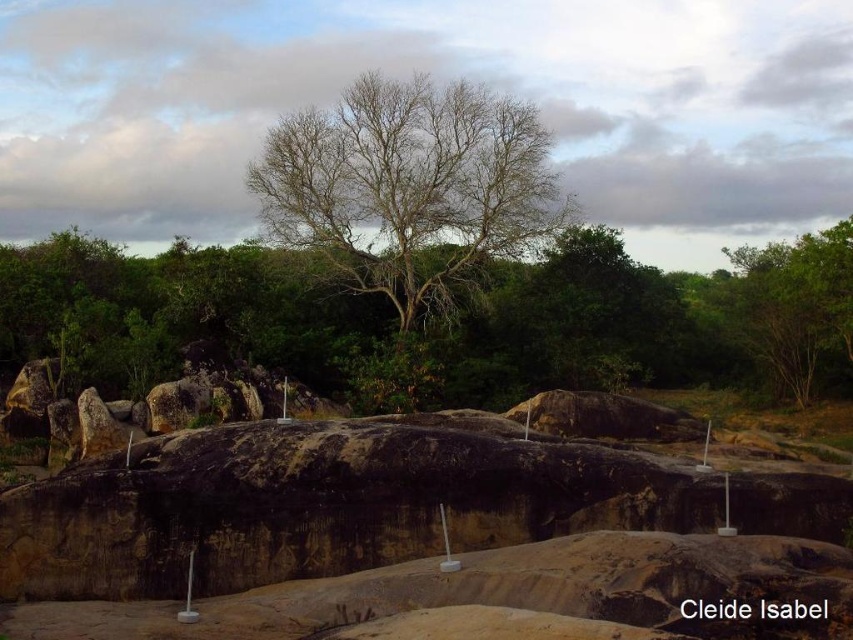
Can you confirm if bare branches at center is positioned to the right of green leafy tree at upper right?

In fact, bare branches at center is to the left of green leafy tree at upper right.

Is bare branches at center further to camera compared to green leafy tree at upper right?

That is True.

Where is `bare branches at center`? bare branches at center is located at coordinates (410, 198).

Where is `bare branches at center`? bare branches at center is located at coordinates (410, 198).